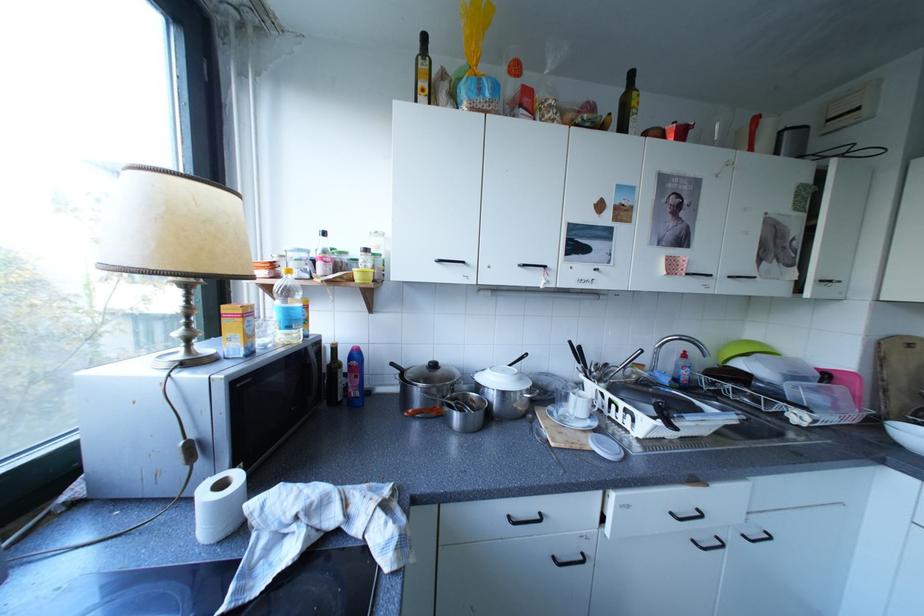
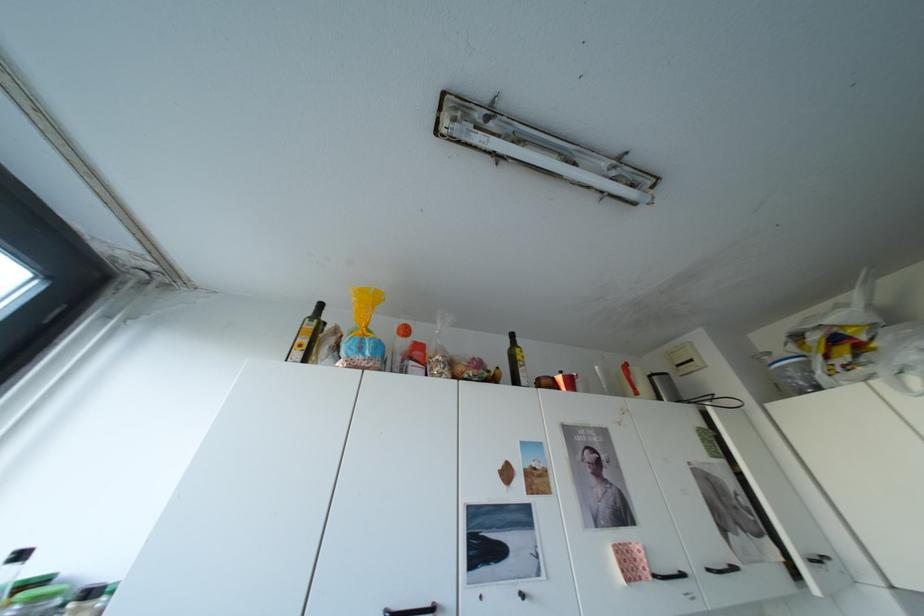
In the second image, find the point that corresponds to the point at 623,114 in the first image.

(511, 368)